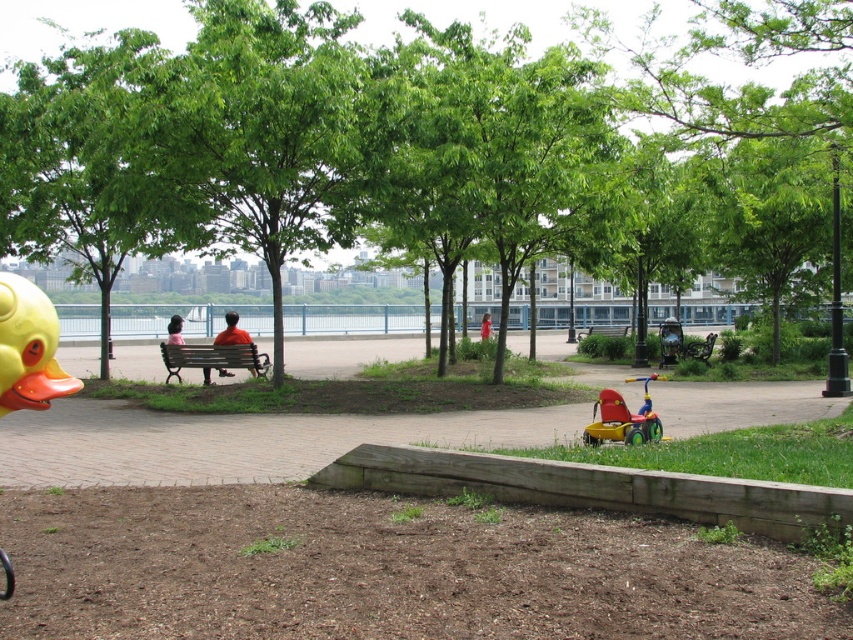
You are a parent pushing a stroller and want to reach the red plastic tricycle at lower center. There is a green leafy tree at center in your path. Can you go around it to reach the tricycle?

The green leafy tree at center is positioned on the left side of the red plastic tricycle at lower center, so you can go around it on the right side to reach the red plastic tricycle at lower center.

You are standing at the wooden retaining wall in the park and want to walk towards the group of people sitting on the bench. There are two points marked as point 1 at coordinates (x=273, y=228) and point 2 at coordinates (x=228, y=328). Which point should you aim for to stay on the path leading to the bench?

Point 1 at coordinates (x=273, y=228) is in front of point 2 at coordinates (x=228, y=328), so you should aim for point 1 to stay on the path leading to the bench.